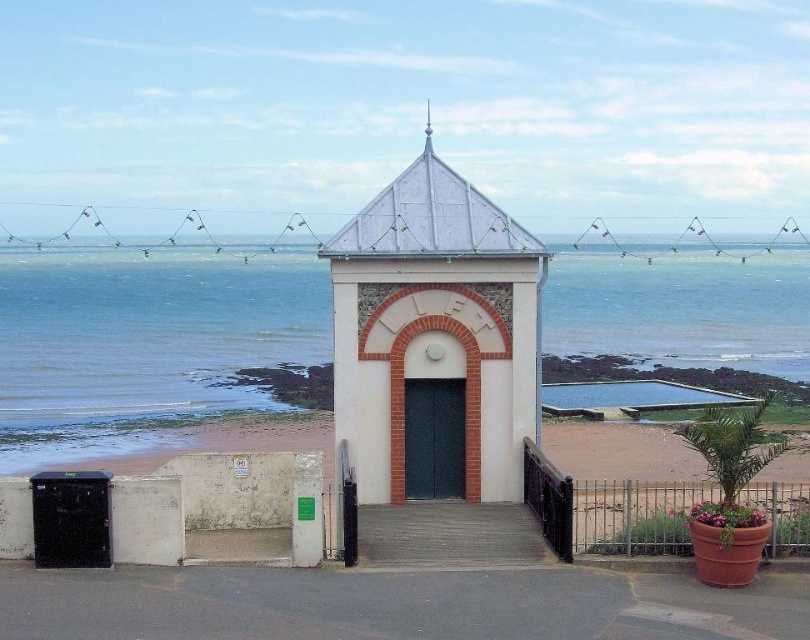
Question: Which object appears closest to the camera in this image?

Choices:
 (A) smooth concrete stairs at center
 (B) white matte chapel at center
 (C) blue water at center

Answer: (A)

Question: Can you confirm if blue water at center is wider than white matte chapel at center?

Choices:
 (A) no
 (B) yes

Answer: (B)

Question: Can you confirm if blue water at center is positioned above smooth concrete stairs at center?

Choices:
 (A) no
 (B) yes

Answer: (B)

Question: Which object appears closest to the camera in this image?

Choices:
 (A) blue water at center
 (B) white matte chapel at center

Answer: (B)

Question: Can you confirm if white matte chapel at center is thinner than smooth concrete stairs at center?

Choices:
 (A) no
 (B) yes

Answer: (A)

Question: Considering the real-world distances, which object is closest to the blue water at center?

Choices:
 (A) white matte chapel at center
 (B) smooth concrete stairs at center

Answer: (A)